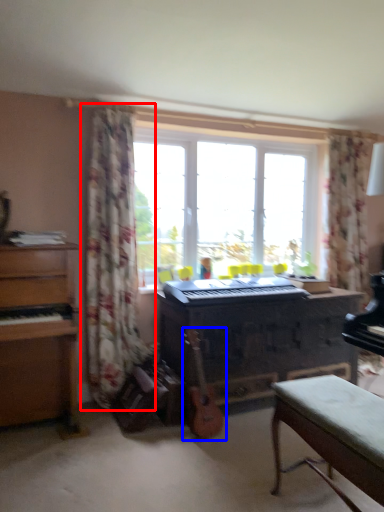
Question: Which object is closer to the camera taking this photo, curtain (highlighted by a red box) or guitar (highlighted by a blue box)?

Choices:
 (A) curtain
 (B) guitar

Answer: (B)